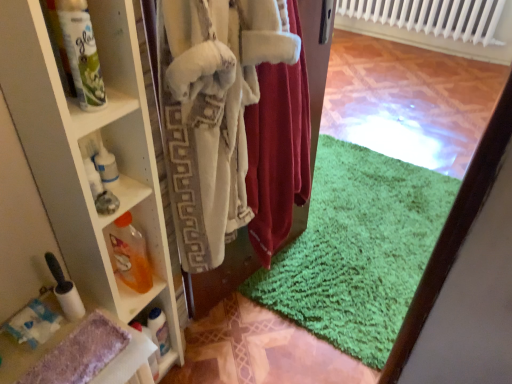
Question: From the image's perspective, is white glossy bottle at lower left, the 1th bottle from the back, positioned above or below white fuzzy robe at center, which appears as the 2th clothing when viewed from the right?

Choices:
 (A) below
 (B) above

Answer: (A)

Question: From their relative heights in the image, would you say white glossy bottle at lower left, the 3th bottle when ordered from front to back, is taller or shorter than white fuzzy robe at center, which is the 1th clothing in left-to-right order?

Choices:
 (A) short
 (B) tall

Answer: (A)

Question: Which of these objects is positioned farthest from the white glossy spray bottle at upper left, which is the 3th bottle from bottom to top?

Choices:
 (A) white glossy shelf at left
 (B) translucent orange liquid at shelf left, the 2th bottle ordered from the bottom
 (C) white fuzzy robe at center, which appears as the 2th clothing when viewed from the right
 (D) velvet red robe at center, which ranks as the 2th clothing in left-to-right order
 (E) white glossy bottle at lower left, the 3th bottle when ordered from front to back

Answer: (E)

Question: Which object is positioned farthest from the white glossy bottle at lower left, the 3th bottle when ordered from front to back?

Choices:
 (A) translucent orange liquid at shelf left, placed as the 2th bottle when sorted from back to front
 (B) white glossy shelf at left
 (C) white glossy spray bottle at upper left, the 1th bottle from the top
 (D) white fuzzy robe at center, which appears as the 2th clothing when viewed from the right
 (E) velvet red robe at center, which ranks as the 2th clothing in left-to-right order

Answer: (C)